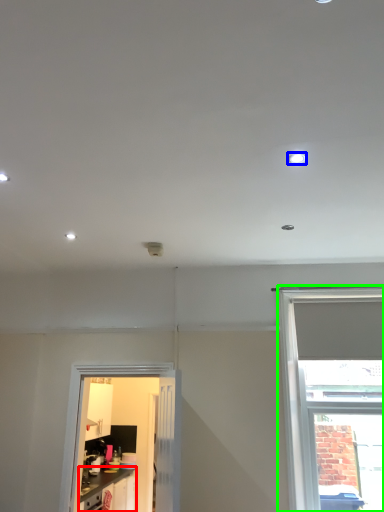
Question: Estimate the real-world distances between objects in this image. Which object is closer to cabinetry (highlighted by a red box), lighting (highlighted by a blue box) or window (highlighted by a green box)?

Choices:
 (A) lighting
 (B) window

Answer: (B)